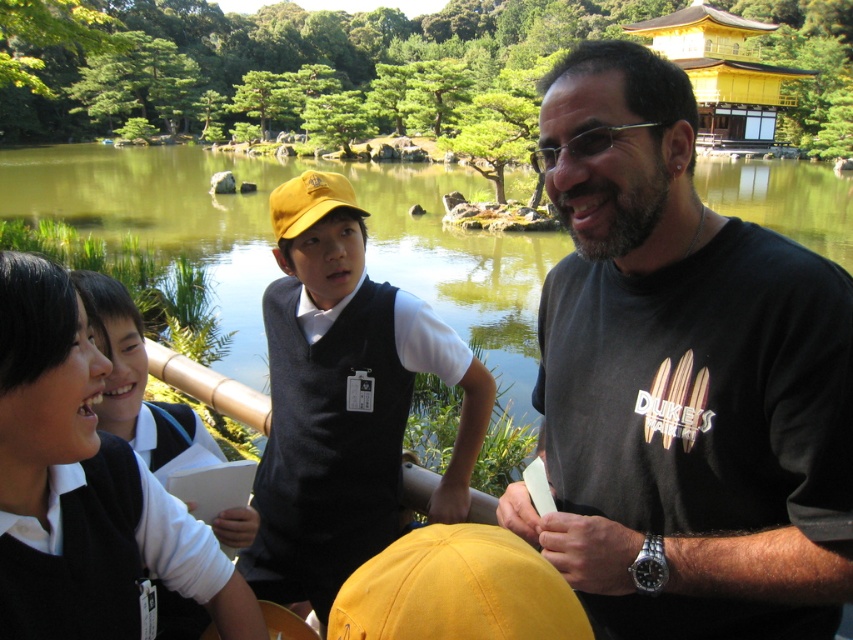
Can you confirm if matte yellow cap at center is bigger than yellow fabric baseball cap at center?

Yes.

Is matte yellow cap at center behind yellow fabric baseball cap at center?

Yes, matte yellow cap at center is further from the viewer.

Image resolution: width=853 pixels, height=640 pixels. Identify the location of matte yellow cap at center. (343, 401).

Looking at this image, is black wool sweater at upper left thinner than yellow fabric baseball cap at center?

No.

Based on the photo, can you confirm if black wool sweater at upper left is positioned to the right of yellow fabric baseball cap at center?

In fact, black wool sweater at upper left is to the left of yellow fabric baseball cap at center.

Who is more forward, (99,384) or (440,621)?

Point (440,621) is more forward.

This screenshot has height=640, width=853. What are the coordinates of `black wool sweater at upper left` in the screenshot? It's located at (68, 464).

Does black matte t-shirt at center have a larger size compared to matte yellow cap at center?

Actually, black matte t-shirt at center might be smaller than matte yellow cap at center.

Is point (560, 452) less distant than point (316, 188)?

Yes, point (560, 452) is closer to viewer.

Locate an element on the screen. black matte t-shirt at center is located at coordinates (682, 380).